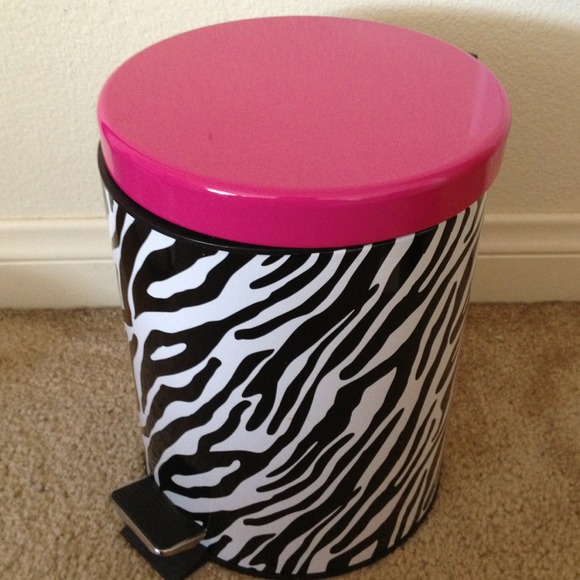
Find the location of a particular element. carpet is located at coordinates (64, 451).